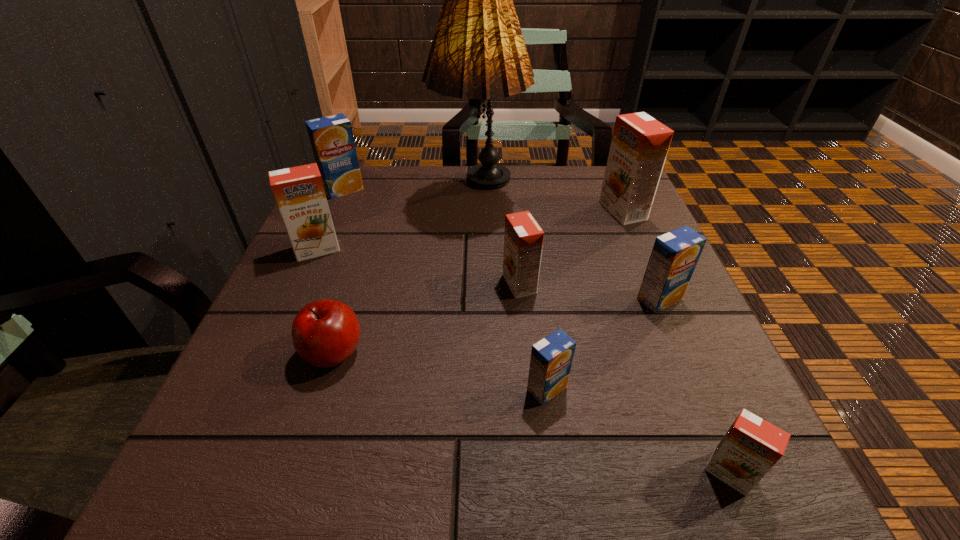
Identify which orange juice is the fourth closest to the apple. Please provide its 2D coordinates. Your answer should be formatted as a tuple, i.e. [(x, y)], where the tuple contains the x and y coordinates of a point satisfying the conditions above.

[(331, 137)]

Choose which orange orange juice is the fourth nearest neighbor to the leftmost blue orange_juice. Please provide its 2D coordinates. Your answer should be formatted as a tuple, i.e. [(x, y)], where the tuple contains the x and y coordinates of a point satisfying the conditions above.

[(751, 447)]

Find the location of a particular element. The height and width of the screenshot is (540, 960). the second closest orange orange juice relative to the second smallest orange orange juice is located at coordinates (299, 192).

I want to click on the second closest blue orange_juice to the tallest object, so click(674, 256).

You are a GUI agent. You are given a task and a screenshot of the screen. Output one action in this format:
    pyautogui.click(x=<x>, y=<y>)
    Task: Click on the closest blue orange_juice to the smallest orange orange juice
    The height and width of the screenshot is (540, 960).
    Given the screenshot: What is the action you would take?
    pyautogui.click(x=551, y=358)

This screenshot has width=960, height=540. I want to click on free space that satisfies the following two spatial constraints: 1. on the front-facing side of the smallest orange orange juice; 2. on the right side of the tallest object, so click(478, 473).

The width and height of the screenshot is (960, 540). I want to click on vacant region that satisfies the following two spatial constraints: 1. on the back side of the biggest orange orange juice; 2. on the right side of the pink apple, so click(377, 211).

Where is `free location that satisfies the following two spatial constraints: 1. on the back side of the rightmost blue orange_juice; 2. on the right side of the biggest orange orange juice`? The height and width of the screenshot is (540, 960). free location that satisfies the following two spatial constraints: 1. on the back side of the rightmost blue orange_juice; 2. on the right side of the biggest orange orange juice is located at coordinates (621, 211).

Locate an element on the screen. This screenshot has height=540, width=960. free spot that satisfies the following two spatial constraints: 1. on the back side of the third biggest orange orange juice; 2. on the left side of the second tallest object is located at coordinates (513, 211).

The image size is (960, 540). I want to click on free region that satisfies the following two spatial constraints: 1. on the front side of the nearest object; 2. on the right side of the farthest blue orange_juice, so click(219, 473).